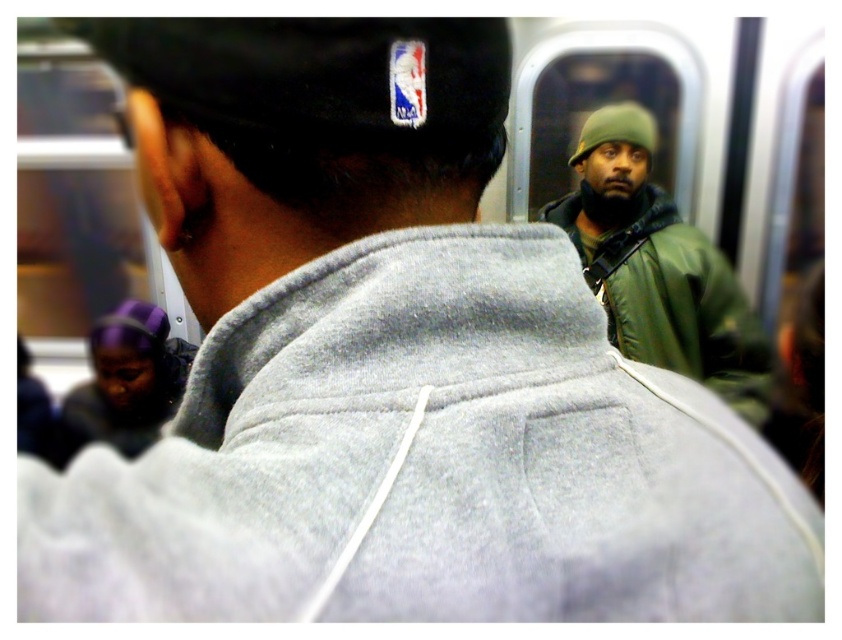
Question: Does green matte jacket at center appear on the right side of green matte baseball hat at upper center?

Choices:
 (A) yes
 (B) no

Answer: (A)

Question: Which of the following is the closest to the observer?

Choices:
 (A) (598, 256)
 (B) (600, 140)

Answer: (A)

Question: Is green matte jacket at center further to camera compared to green matte baseball hat at upper center?

Choices:
 (A) yes
 (B) no

Answer: (B)

Question: Which of the following is the closest to the observer?

Choices:
 (A) (691, 248)
 (B) (614, 116)

Answer: (A)

Question: Is green matte jacket at center smaller than green matte baseball hat at upper center?

Choices:
 (A) no
 (B) yes

Answer: (A)

Question: Among these objects, which one is nearest to the camera?

Choices:
 (A) green matte jacket at center
 (B) green matte baseball hat at upper center

Answer: (A)